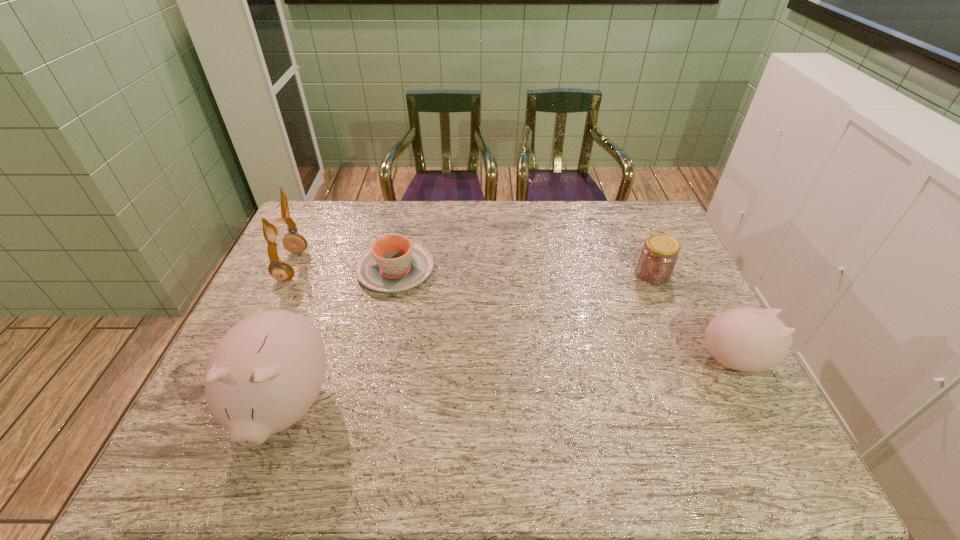
Where is `object that is the second closest one to the earphone`? The height and width of the screenshot is (540, 960). object that is the second closest one to the earphone is located at coordinates pos(265,373).

Locate an element on the screen. object that ranks as the third closest to the taller piggy bank is located at coordinates (659, 255).

Identify the location of vacant space that satisfies the following two spatial constraints: 1. on the front-facing side of the jam; 2. on the left side of the earphone. This screenshot has width=960, height=540. (288, 273).

Find the location of a particular element. free spot that satisfies the following two spatial constraints: 1. at the snout of the shorter piggy bank; 2. at the snout of the taller piggy bank is located at coordinates (760, 407).